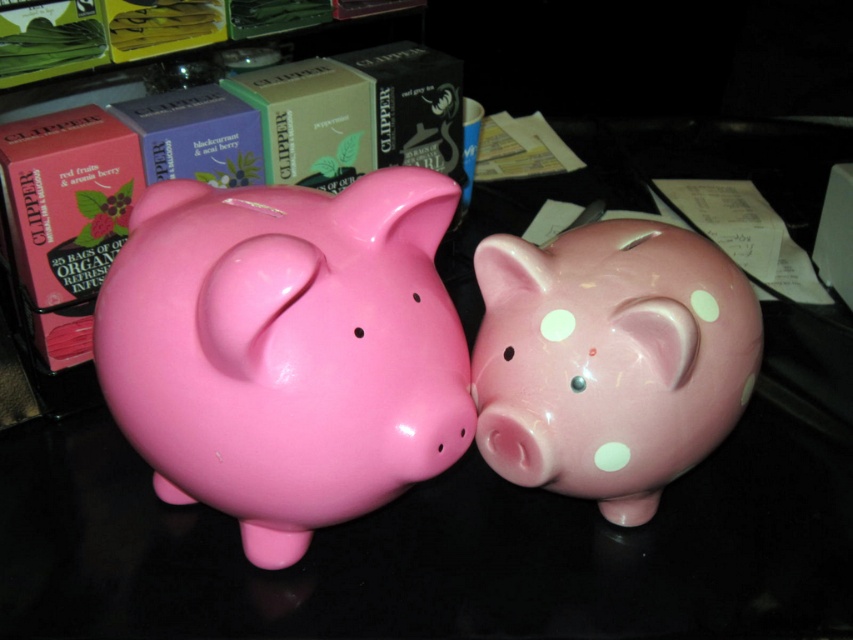
Question: Does glossy ceramic piggy bank at center left appear on the right side of pink glossy piggy bank at center?

Choices:
 (A) no
 (B) yes

Answer: (A)

Question: Which point appears farthest from the camera in this image?

Choices:
 (A) (614, 305)
 (B) (238, 467)

Answer: (A)

Question: Observing the image, what is the correct spatial positioning of glossy ceramic piggy bank at center left in reference to pink glossy piggy bank at center?

Choices:
 (A) above
 (B) below

Answer: (A)

Question: In this image, where is glossy ceramic piggy bank at center left located relative to pink glossy piggy bank at center?

Choices:
 (A) right
 (B) left

Answer: (B)